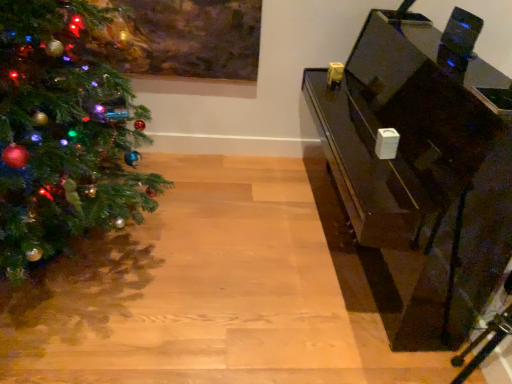
Question: From a real-world perspective, is glossy black piano at right physically located above or below shiny green christmas tree at left?

Choices:
 (A) below
 (B) above

Answer: (A)

Question: Based on their positions, is glossy black piano at right located to the left or right of shiny green christmas tree at left?

Choices:
 (A) right
 (B) left

Answer: (A)

Question: From the image's perspective, is glossy black piano at right located above or below shiny green christmas tree at left?

Choices:
 (A) below
 (B) above

Answer: (A)

Question: Would you say shiny green christmas tree at left is to the left or to the right of glossy black piano at right in the picture?

Choices:
 (A) left
 (B) right

Answer: (A)

Question: Does point (151, 177) appear closer or farther from the camera than point (440, 278)?

Choices:
 (A) closer
 (B) farther

Answer: (B)

Question: In the image, is shiny green christmas tree at left positioned in front of or behind glossy black piano at right?

Choices:
 (A) front
 (B) behind

Answer: (A)

Question: Considering the positions of shiny green christmas tree at left and glossy black piano at right in the image, is shiny green christmas tree at left wider or thinner than glossy black piano at right?

Choices:
 (A) thin
 (B) wide

Answer: (B)